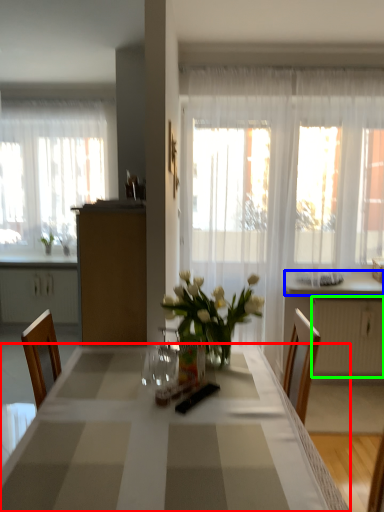
Question: Considering the real-world distances, which object is farthest from desk (highlighted by a red box)? counter top (highlighted by a blue box) or radiator (highlighted by a green box)?

Choices:
 (A) counter top
 (B) radiator

Answer: (A)